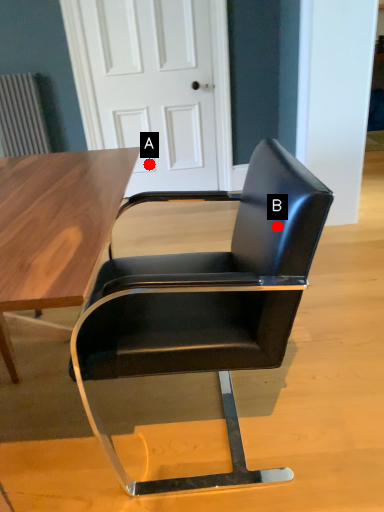
Question: Two points are circled on the image, labeled by A and B beside each circle. Which point is closer to the camera?

Choices:
 (A) A is closer
 (B) B is closer

Answer: (B)